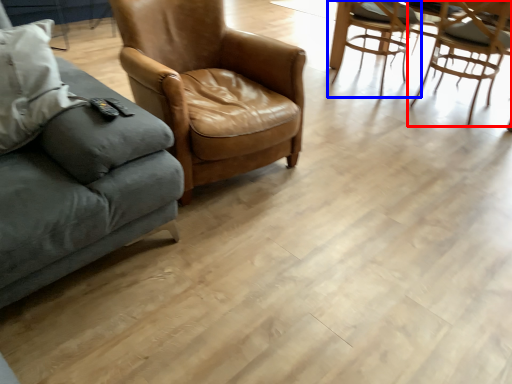
Question: Which object appears farthest to the camera in this image, chair (highlighted by a red box) or chair (highlighted by a blue box)?

Choices:
 (A) chair
 (B) chair

Answer: (B)